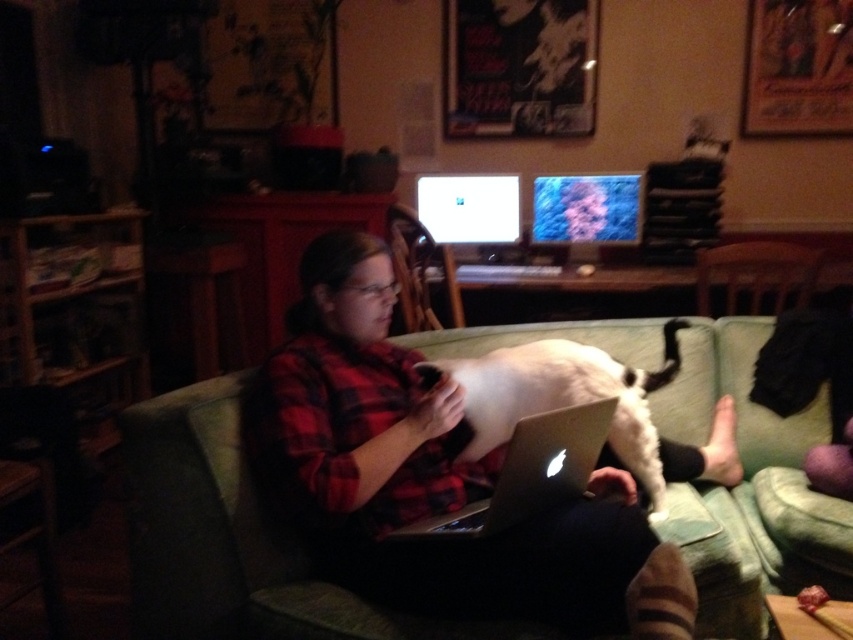
Consider the image. You are a delivery robot with a package that needs to be placed on the silver metallic laptop at center. The robot has an arm that can reach up to 1.2 meters. Can the robot place the package on the laptop?

The silver metallic laptop at center is 1.29 meters from the camera. Since the robot arm can only reach up to 1.2 meters, it cannot reach the laptop to place the package.

You are a photographer trying to capture a clear photo of the white fur cat at center without blurring it. Given that your camera has a depth of field that can focus on objects within a 5 feet range from the current focus point, where should you set the focus to ensure the cat is sharp?

To ensure the white fur cat at center is sharp, set the focus point at its position since it is 5.37 feet away from the camera. However, since the depth of field covers 5 feet, adjusting slightly closer might help, but the closest focus would still need to be within 0.37 feet of the cat to keep it within the 5 feet range. Alternatively, focus directly on the cat as it is the main subject, and the depth of field will cover it adequately if the camera is set to a suitable aperture.